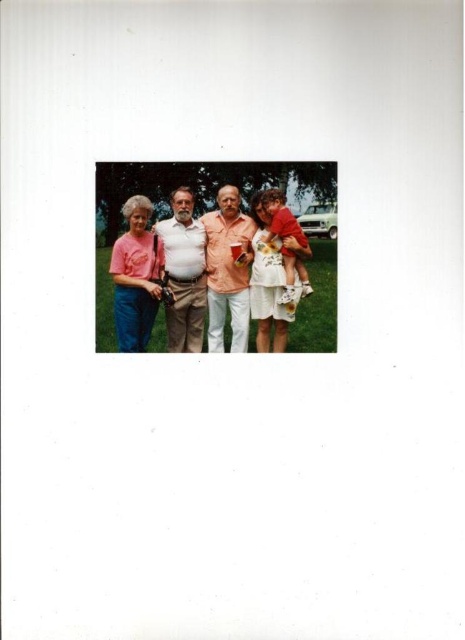
Question: Which object is closer to the camera taking this photo?

Choices:
 (A) floral cotton dress at center
 (B) pink cotton shirt at center
 (C) pink t-shirt at left

Answer: (C)

Question: Which point is farther to the camera?

Choices:
 (A) light brown cotton shirt at center
 (B) floral cotton dress at center
 (C) matte orange shirt at center

Answer: (B)

Question: Is pink t-shirt at left above floral cotton dress at center?

Choices:
 (A) no
 (B) yes

Answer: (A)

Question: Considering the real-world distances, which object is closest to the matte orange shirt at center?

Choices:
 (A) light brown cotton shirt at center
 (B) floral cotton dress at center
 (C) pink cotton shirt at center

Answer: (C)

Question: Considering the relative positions of pink cotton shirt at center and pink t-shirt at left in the image provided, where is pink cotton shirt at center located with respect to pink t-shirt at left?

Choices:
 (A) right
 (B) left

Answer: (A)

Question: Can you confirm if pink cotton shirt at center is positioned to the left of matte orange shirt at center?

Choices:
 (A) no
 (B) yes

Answer: (B)